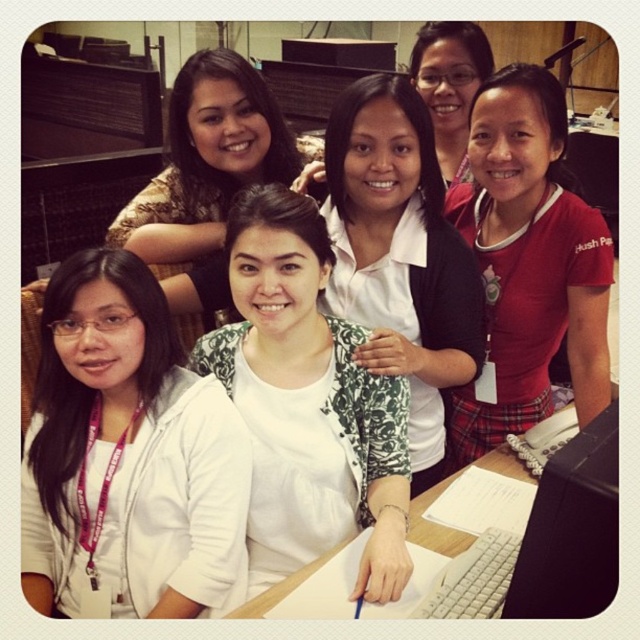
Question: Can you confirm if red matte shirt at upper right is thinner than white matte shirt at center?

Choices:
 (A) no
 (B) yes

Answer: (B)

Question: Based on their relative distances, which object is nearer to the black plastic monitor at lower right?

Choices:
 (A) red matte shirt at upper right
 (B) white fabric shirt at center

Answer: (B)

Question: Does white fabric shirt at center appear on the left side of matte floral shirt at center?

Choices:
 (A) no
 (B) yes

Answer: (A)

Question: In this image, where is red matte shirt at upper right located relative to matte floral shirt at center?

Choices:
 (A) below
 (B) above

Answer: (A)

Question: Which object is the closest to the black plastic monitor at lower right?

Choices:
 (A) red matte shirt at upper right
 (B) wooden desk at lower center

Answer: (B)

Question: Among these points, which one is farthest from the camera?

Choices:
 (A) pyautogui.click(x=541, y=586)
 (B) pyautogui.click(x=524, y=378)
 (C) pyautogui.click(x=252, y=532)

Answer: (B)